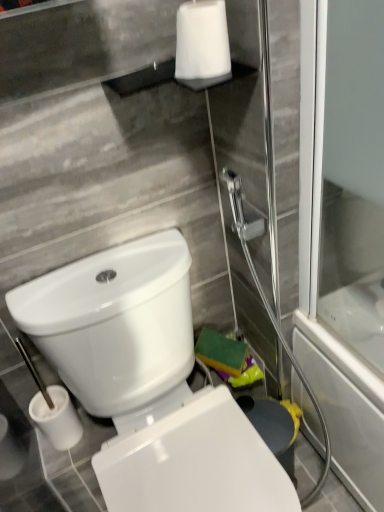
Question: Would you say white glossy toilet at lower left is inside or outside white matte toilet paper at upper center?

Choices:
 (A) inside
 (B) outside

Answer: (B)

Question: From the image's perspective, is white glossy toilet at lower left positioned above or below white matte toilet paper at upper center?

Choices:
 (A) above
 (B) below

Answer: (B)

Question: Considering the positions of white glossy toilet at lower left and white matte toilet paper at upper center in the image, is white glossy toilet at lower left taller or shorter than white matte toilet paper at upper center?

Choices:
 (A) short
 (B) tall

Answer: (B)

Question: Considering the positions of white matte toilet paper at upper center and white glossy toilet at lower left in the image, is white matte toilet paper at upper center taller or shorter than white glossy toilet at lower left?

Choices:
 (A) short
 (B) tall

Answer: (A)

Question: Considering the positions of white matte toilet paper at upper center and white glossy toilet at lower left in the image, is white matte toilet paper at upper center bigger or smaller than white glossy toilet at lower left?

Choices:
 (A) small
 (B) big

Answer: (A)

Question: Is white matte toilet paper at upper center in front of or behind white glossy toilet at lower left in the image?

Choices:
 (A) front
 (B) behind

Answer: (B)

Question: Is white matte toilet paper at upper center inside the boundaries of white glossy toilet at lower left, or outside?

Choices:
 (A) outside
 (B) inside

Answer: (A)